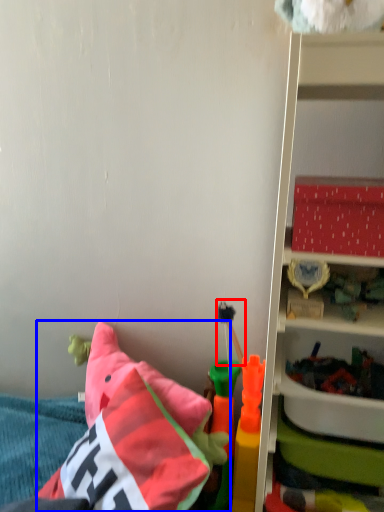
Question: Among these objects, which one is nearest to the camera, toy (highlighted by a red box) or pillow (highlighted by a blue box)?

Choices:
 (A) toy
 (B) pillow

Answer: (B)